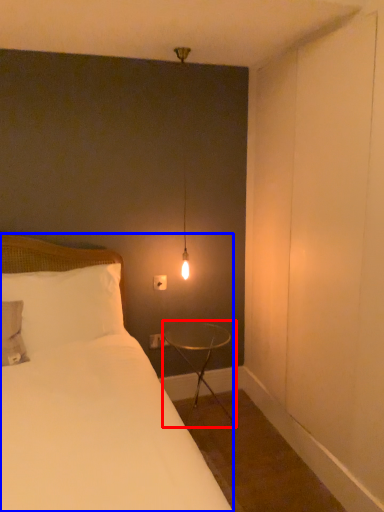
Question: Which object is further to the camera taking this photo, table (highlighted by a red box) or bed (highlighted by a blue box)?

Choices:
 (A) table
 (B) bed

Answer: (A)